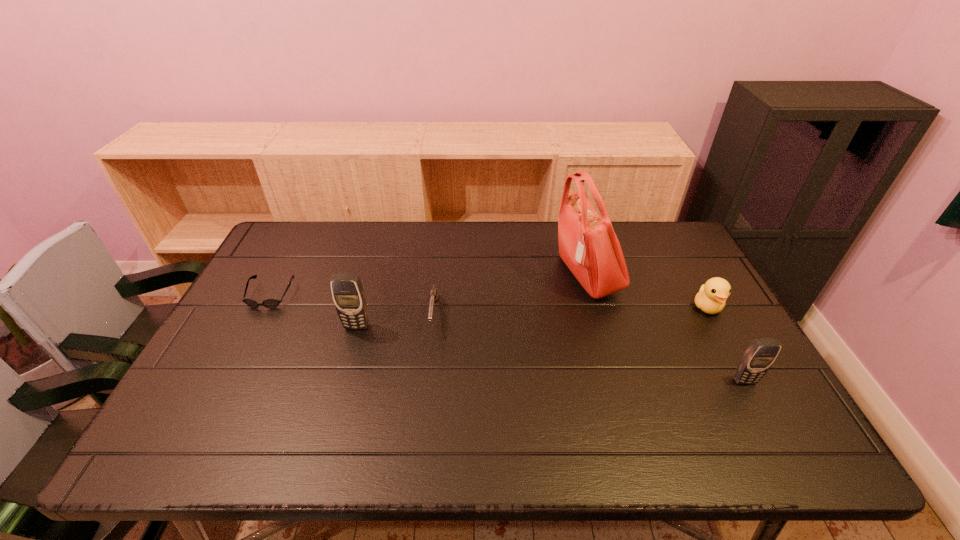
You are a GUI agent. You are given a task and a screenshot of the screen. Output one action in this format:
    pyautogui.click(x=<x>, y=<y>)
    Task: Click on the object located at the near edge
    
    Given the screenshot: What is the action you would take?
    pyautogui.click(x=758, y=358)

This screenshot has height=540, width=960. I want to click on object that is positioned at the left edge, so click(268, 303).

You are a GUI agent. You are given a task and a screenshot of the screen. Output one action in this format:
    pyautogui.click(x=<x>, y=<y>)
    Task: Click on the cellular telephone that is positioned at the right edge
    
    Given the screenshot: What is the action you would take?
    pyautogui.click(x=758, y=358)

Find the location of a particular element. duck located in the right edge section of the desktop is located at coordinates (712, 295).

The image size is (960, 540). What are the coordinates of `object that is at the near right corner` in the screenshot? It's located at (758, 358).

Where is `free space at the far edge of the desktop`? The height and width of the screenshot is (540, 960). free space at the far edge of the desktop is located at coordinates (527, 259).

In the image, there is a desktop. At what (x,y) coordinates should I click in order to perform the action: click on vacant space at the near edge. Please return your answer as a coordinate pair (x, y). Looking at the image, I should click on (650, 417).

The image size is (960, 540). In order to click on vacant space at the left edge of the desktop in this screenshot , I will do `click(251, 384)`.

At what (x,y) coordinates should I click in order to perform the action: click on free region at the right edge. Please return your answer as a coordinate pair (x, y). Image resolution: width=960 pixels, height=540 pixels. Looking at the image, I should click on (697, 283).

In the image, there is a desktop. Where is `free space at the far left corner`? The height and width of the screenshot is (540, 960). free space at the far left corner is located at coordinates (295, 228).